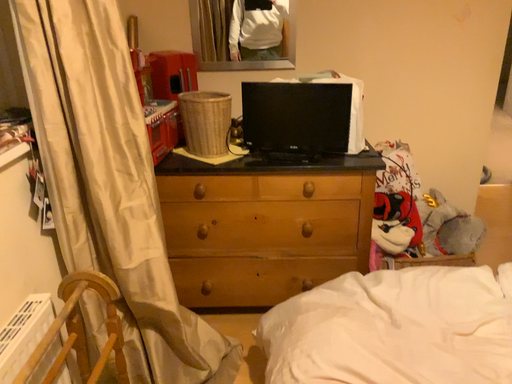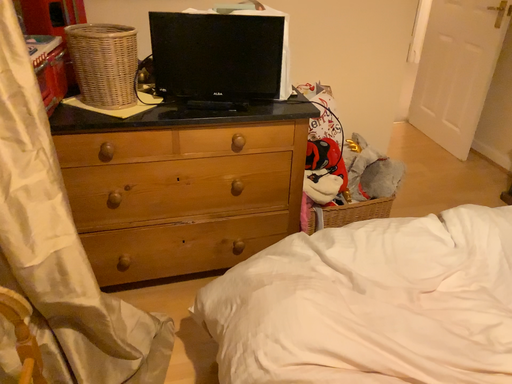
Question: Which way did the camera rotate in the video?

Choices:
 (A) rotated left
 (B) rotated right

Answer: (B)